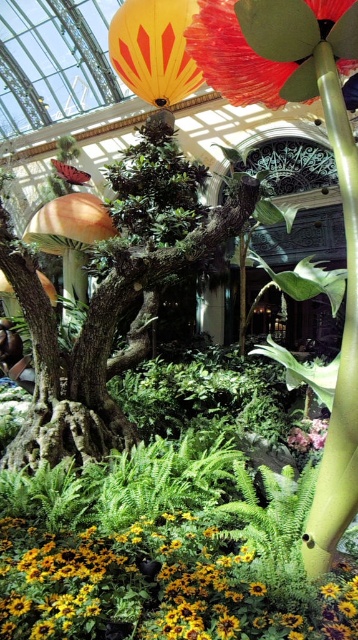
Question: Is yellow paper lantern at upper center positioned in front of silky pink petals at center?

Choices:
 (A) yes
 (B) no

Answer: (B)

Question: Which object is closer to the camera taking this photo?

Choices:
 (A) yellow matte flower at lower center
 (B) green rough bark tree at center
 (C) silky pink petals at center
 (D) yellow paper lantern at upper center

Answer: (A)

Question: Which object appears closest to the camera in this image?

Choices:
 (A) yellow matte flower at lower center
 (B) silky pink petals at center

Answer: (A)

Question: Which of the following is the farthest from the observer?

Choices:
 (A) green rough bark tree at center
 (B) yellow matte flower at lower center
 (C) yellow paper lantern at upper center
 (D) silky pink petals at center

Answer: (A)

Question: Is yellow matte flower at lower center smaller than yellow paper lantern at upper center?

Choices:
 (A) no
 (B) yes

Answer: (B)

Question: Can you confirm if green rough bark tree at center is smaller than yellow matte flower at lower center?

Choices:
 (A) no
 (B) yes

Answer: (A)